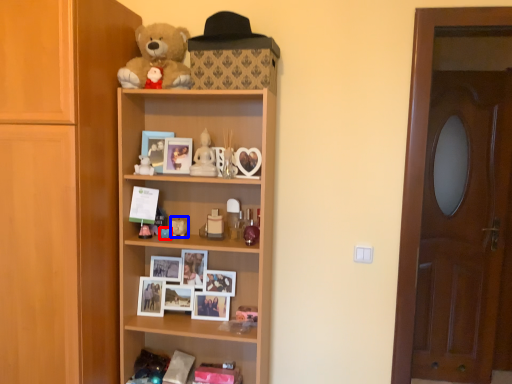
Question: Which point is closer to the camera, toy (highlighted by a red box) or toy (highlighted by a blue box)?

Choices:
 (A) toy
 (B) toy

Answer: (A)